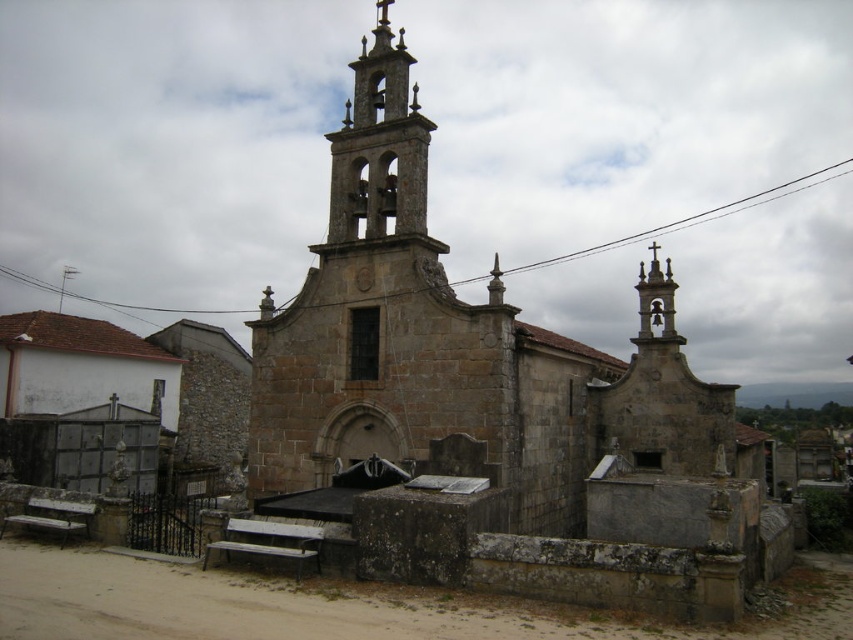
You are standing in front of the church and notice two stone bell towers. The first is labeled as the stone bell tower at center, and the second is the stone bell tower at upper center. Which of these two bell towers is taller?

The stone bell tower at center is taller than the stone bell tower at upper center.